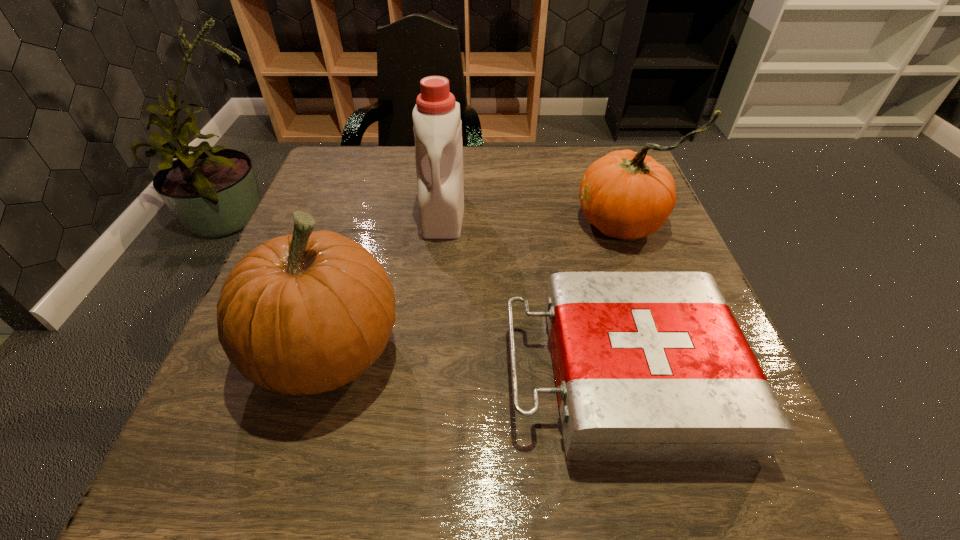
Identify the location of the second closest object to the first-aid kit. The width and height of the screenshot is (960, 540). (306, 313).

Point out which object is positioned as the nearest to the left pumpkin. Please provide its 2D coordinates. Your answer should be formatted as a tuple, i.e. [(x, y)], where the tuple contains the x and y coordinates of a point satisfying the conditions above.

[(437, 127)]

Image resolution: width=960 pixels, height=540 pixels. Identify the location of free spot that satisfies the following two spatial constraints: 1. on the handle side of the detergent; 2. on the stem of the left pumpkin. (429, 351).

Locate an element on the screen. This screenshot has height=540, width=960. free space that satisfies the following two spatial constraints: 1. on the front side of the farther pumpkin; 2. on the stem of the left pumpkin is located at coordinates (667, 351).

The height and width of the screenshot is (540, 960). What are the coordinates of `free space that satisfies the following two spatial constraints: 1. on the handle side of the detergent; 2. on the stem of the left pumpkin` in the screenshot? It's located at (429, 351).

The image size is (960, 540). I want to click on blank area in the image that satisfies the following two spatial constraints: 1. on the handle side of the detergent; 2. on the left side of the farther pumpkin, so click(x=443, y=222).